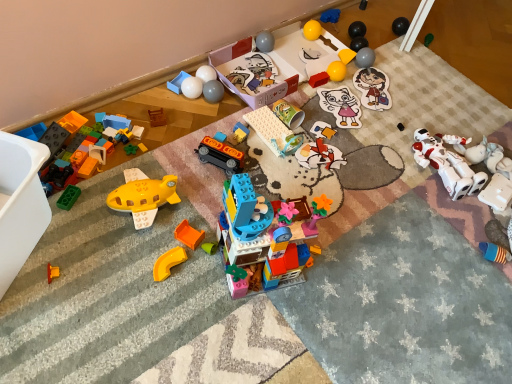
Question: From the image's perspective, relative to white glossy balls at upper center, marked as the twentieth toy in a right-to-left arrangement, is blue rubber toy at lower right, the 24th toy positioned from the left, above or below?

Choices:
 (A) above
 (B) below

Answer: (B)

Question: Looking at their shapes, would you say blue rubber toy at lower right, the 24th toy positioned from the left, is wider or thinner than white glossy balls at upper center, marked as the twentieth toy in a right-to-left arrangement?

Choices:
 (A) thin
 (B) wide

Answer: (B)

Question: Which object is positioned farthest from the white glossy balls at upper center, marked as the twentieth toy in a right-to-left arrangement?

Choices:
 (A) yellow rubber ball at upper center, the 11th toy when ordered from right to left
 (B) matte plastic cup at center, positioned as the fourteenth toy in right-to-left order
 (C) yellow plastic curve at lower left, which ranks as the 6th toy in left-to-right order
 (D) matte plastic train at center, which is the 11th toy in left-to-right order
 (E) blue rubber toy at lower right, the 24th toy positioned from the left

Answer: (E)

Question: Considering the real-world distances, which object is farthest from the cardboard box at center?

Choices:
 (A) matte cardboard puzzle piece at center, arranged as the 15th toy when viewed from the left
 (B) wooden block at center, the 24th toy from the right
 (C) yellow matte square at upper center, which is the 19th toy in left-to-right order
 (D) matte white cat at center, placed as the seventeenth toy when sorted from left to right
 (E) matte plastic toy blocks at upper center, which is the 22th toy from right to left

Answer: (B)